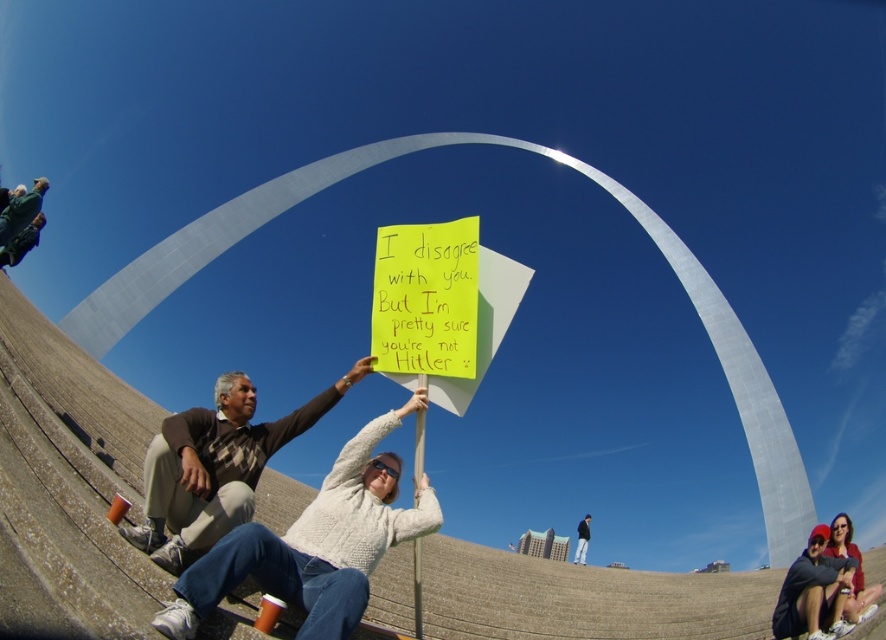
You are a photographer standing at the base of the Gateway Arch and see the brown sweater at center and the dark blue jeans at lower right in your viewfinder. Which item is positioned higher in the frame?

The brown sweater at center is positioned higher in the frame than the dark blue jeans at lower right.

You are standing at the base of the Gateway Arch and notice two points marked in the scene. The first point is at coordinates point [183,545] and the second is at point [581,547]. Which of these points is closer to you?

Point [183,545] is in front of point [581,547], so it is closer to you.

You are a photographer trying to capture a photo of the Gateway Arch. You notice two people sitting on the steps in front of the arch. Which person should you ask to move so that the brown sweater at center and the dark blue jeans at lower right do not block the view of the arch?

Result: You should ask the dark blue jeans at lower right to move because the brown sweater at center is shorter than the dark blue jeans at lower right, meaning the dark blue jeans at lower right is taller and blocking more of the arch.